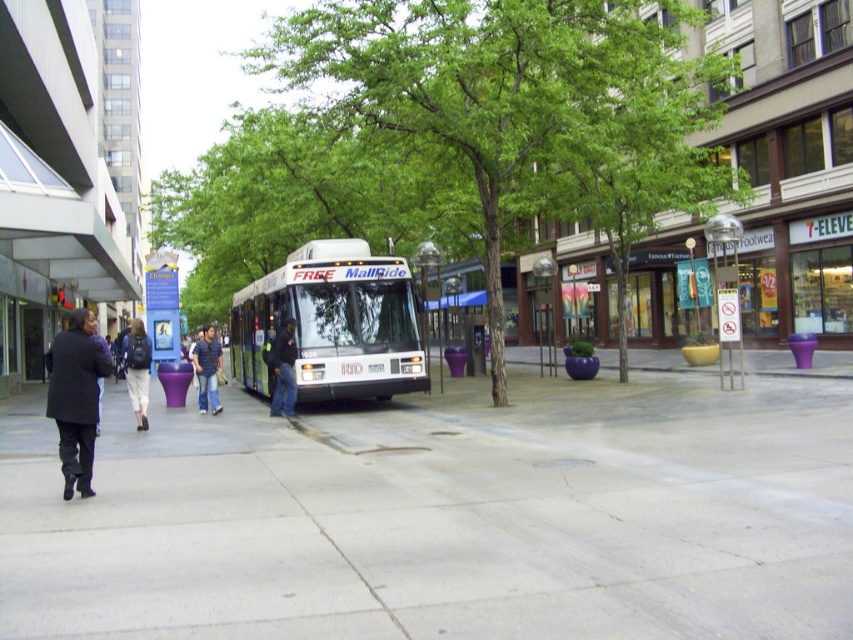
What is the 2D coordinate of the gray concrete pavement at center?

The gray concrete pavement at center is located at the 2D coordinate point of (x=444, y=516).

You are a pedestrian standing on the sidewalk. You see the white metallic bus at center and the black matte coat at left. Which object is higher from the ground?

The white metallic bus at center is higher from the ground than the black matte coat at left.